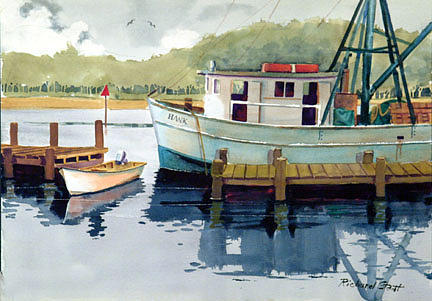
The width and height of the screenshot is (432, 301). I want to click on window, so click(x=289, y=87), click(x=277, y=87), click(x=216, y=85), click(x=209, y=81).